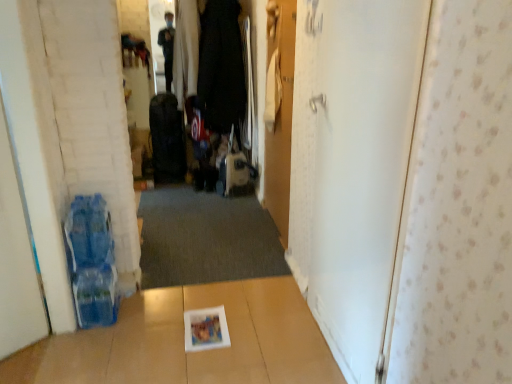
Question: Does white matte door at left, acting as the third door starting from the right, have a greater height compared to dark gray carpet at center?

Choices:
 (A) no
 (B) yes

Answer: (B)

Question: From the image's perspective, is white matte door at left, which is the first door in left-to-right order, below dark gray carpet at center?

Choices:
 (A) yes
 (B) no

Answer: (B)

Question: From a real-world perspective, is white matte door at left, which is the first door in left-to-right order, beneath dark gray carpet at center?

Choices:
 (A) yes
 (B) no

Answer: (B)

Question: Considering the relative sizes of white matte door at left, acting as the third door starting from the right, and dark gray carpet at center in the image provided, is white matte door at left, acting as the third door starting from the right, thinner than dark gray carpet at center?

Choices:
 (A) yes
 (B) no

Answer: (A)

Question: Are white matte door at left, which is the first door in left-to-right order, and dark gray carpet at center making contact?

Choices:
 (A) no
 (B) yes

Answer: (A)

Question: Is dark gray carpet at center situated inside white matte door at left, which is the first door in left-to-right order, or outside?

Choices:
 (A) outside
 (B) inside

Answer: (A)

Question: Is dark gray carpet at center wider or thinner than white matte door at left, acting as the third door starting from the right?

Choices:
 (A) thin
 (B) wide

Answer: (B)

Question: From a real-world perspective, is dark gray carpet at center positioned above or below white matte door at left, which is the first door in left-to-right order?

Choices:
 (A) above
 (B) below

Answer: (B)

Question: Looking at the image, does dark gray carpet at center seem bigger or smaller compared to white matte door at left, acting as the third door starting from the right?

Choices:
 (A) small
 (B) big

Answer: (B)

Question: Is dark gray carpet at center bigger or smaller than white glossy magazine at center?

Choices:
 (A) big
 (B) small

Answer: (A)

Question: Looking at their shapes, would you say dark gray carpet at center is wider or thinner than white glossy magazine at center?

Choices:
 (A) thin
 (B) wide

Answer: (B)

Question: Does point (254, 215) appear closer or farther from the camera than point (198, 327)?

Choices:
 (A) farther
 (B) closer

Answer: (A)

Question: Visually, is dark gray carpet at center positioned to the left or to the right of white glossy magazine at center?

Choices:
 (A) right
 (B) left

Answer: (B)

Question: Is white matte door at left, acting as the third door starting from the right, to the left or to the right of wooden door at center, acting as the second door starting from the right, in the image?

Choices:
 (A) right
 (B) left

Answer: (B)

Question: Does point (4, 321) appear closer or farther from the camera than point (278, 185)?

Choices:
 (A) farther
 (B) closer

Answer: (B)